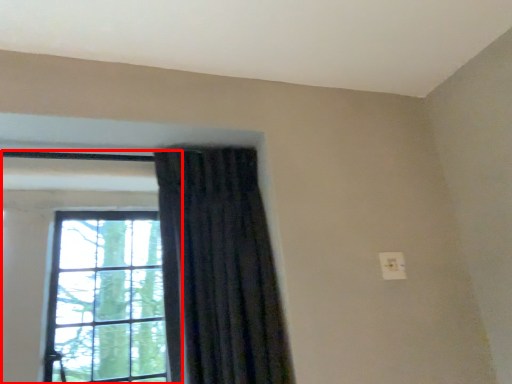
Question: From the image's perspective, where is window (annotated by the red box) located relative to curtain?

Choices:
 (A) above
 (B) below

Answer: (B)